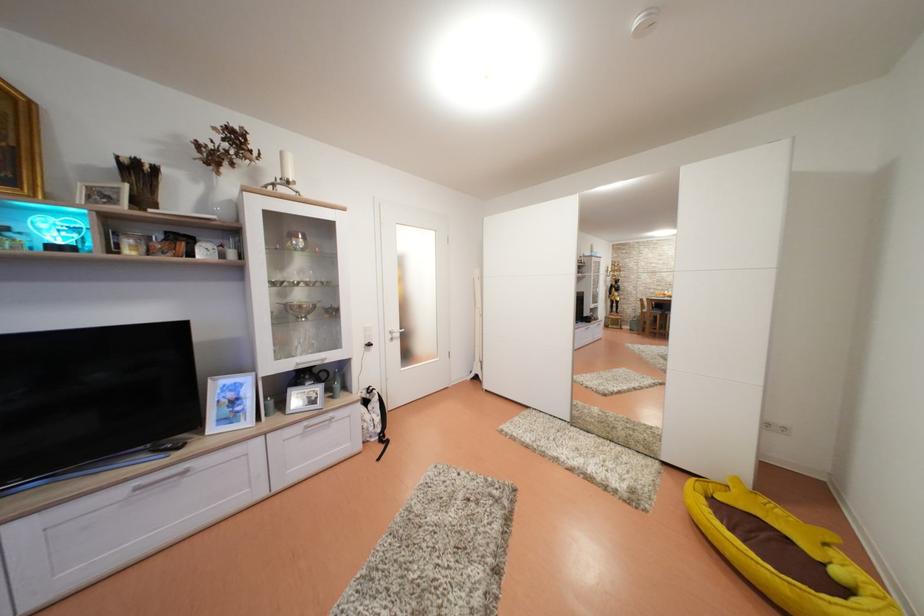
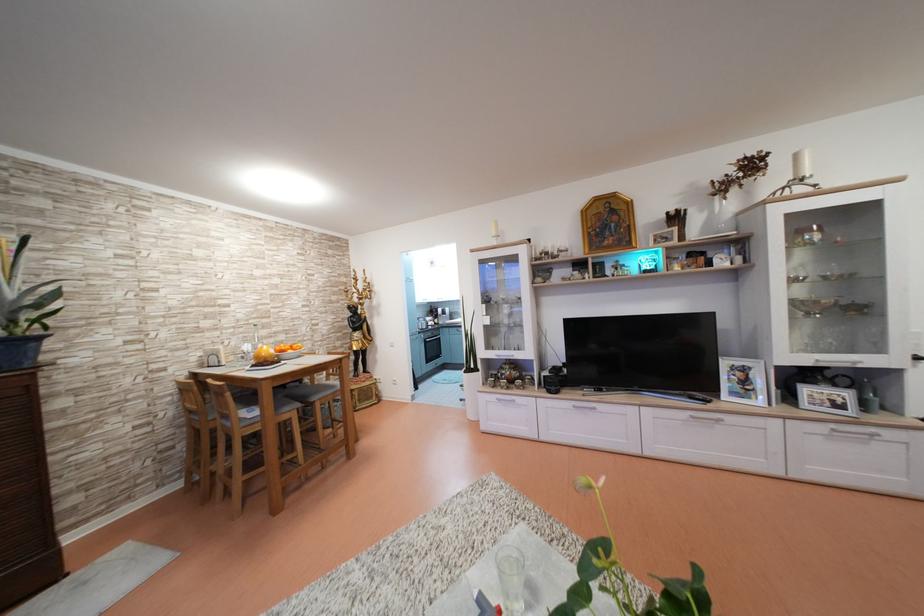
The point at (x=312, y=429) is marked in the first image. Where is the corresponding point in the second image?

(840, 431)